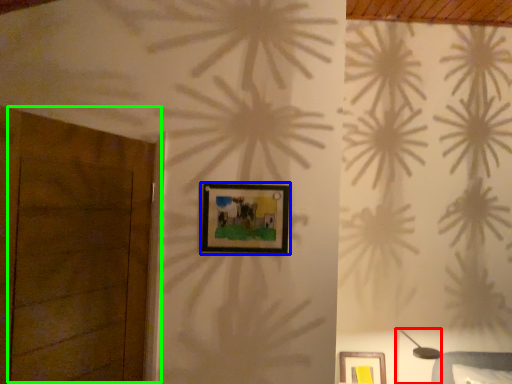
Question: Which is farther away from table lamp (highlighted by a red box)? picture frame (highlighted by a blue box) or door (highlighted by a green box)?

Choices:
 (A) picture frame
 (B) door

Answer: (B)